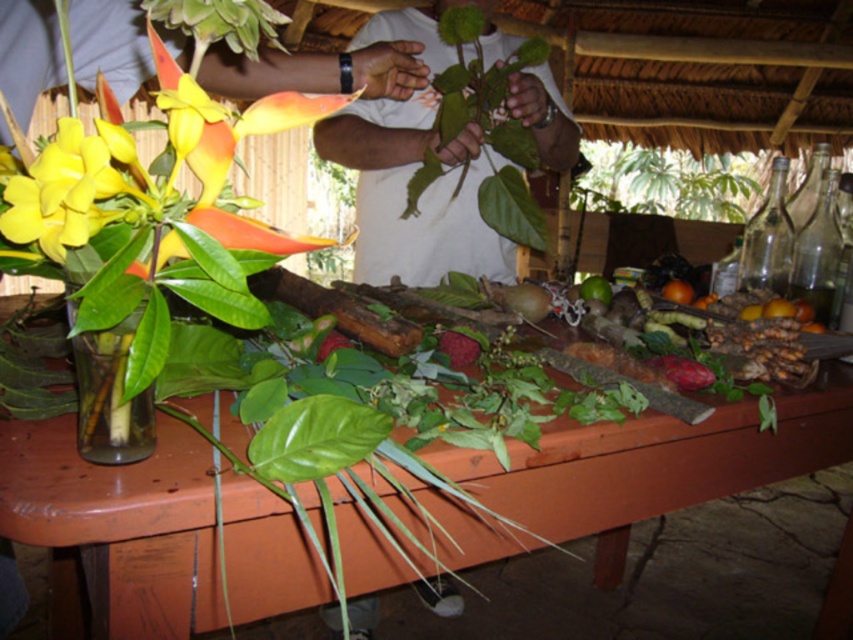
Question: Does yellow matte flower at upper left come behind ripe red berry at center?

Choices:
 (A) yes
 (B) no

Answer: (B)

Question: Does green matte leafy plant at center appear over matte glass vase at left?

Choices:
 (A) yes
 (B) no

Answer: (B)

Question: Estimate the real-world distances between objects in this image. Which object is closer to the orange matte at center?

Choices:
 (A) clear glass vase at left
 (B) yellow matte flower at upper left

Answer: (B)

Question: Which point is closer to the camera?

Choices:
 (A) wooden table at center
 (B) ripe red berry at center
 (C) green leafy plant at upper center

Answer: (A)

Question: Estimate the real-world distances between objects in this image. Which object is farther from the green matte lime at center?

Choices:
 (A) yellow matte flower at upper left
 (B) orange matte at center
 (C) clear glass vase at left
 (D) yellow matte flower at left

Answer: (D)

Question: Can you confirm if green matte leafy plant at center is positioned below green matte lime at center?

Choices:
 (A) no
 (B) yes

Answer: (A)